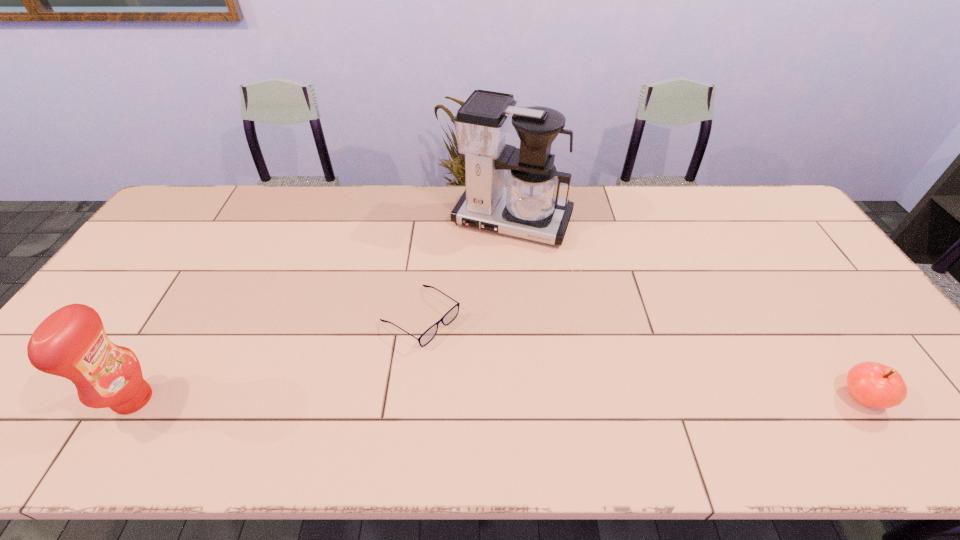
Find the location of a particular element. free spot on the desktop that is between the second tallest object and the apple and is positioned on the front-facing side of the second farthest object is located at coordinates (539, 398).

At what (x,y) coordinates should I click in order to perform the action: click on free space on the desktop that is between the leftmost object and the second shortest object and is positioned at the front of the coffee maker where the controls are located. Please return your answer as a coordinate pair (x, y). Looking at the image, I should click on (430, 399).